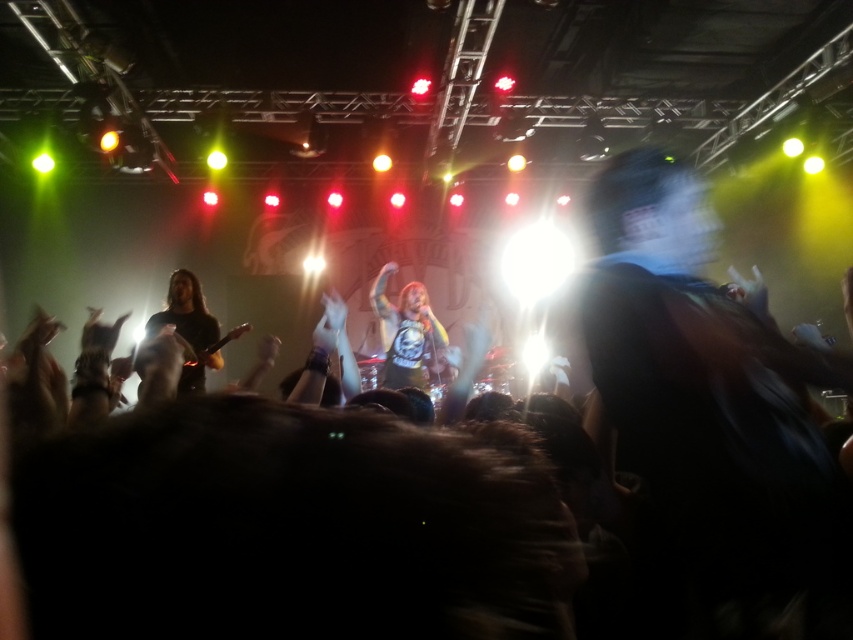
Can you confirm if shiny silver guitar at center is taller than black matte guitar at left?

Correct, shiny silver guitar at center is much taller as black matte guitar at left.

Is shiny silver guitar at center closer to the viewer compared to black matte guitar at left?

No.

Does point (408, 324) come farther from viewer compared to point (165, 314)?

Yes, point (408, 324) is farther from viewer.

Where is `shiny silver guitar at center`? Image resolution: width=853 pixels, height=640 pixels. shiny silver guitar at center is located at coordinates (408, 333).